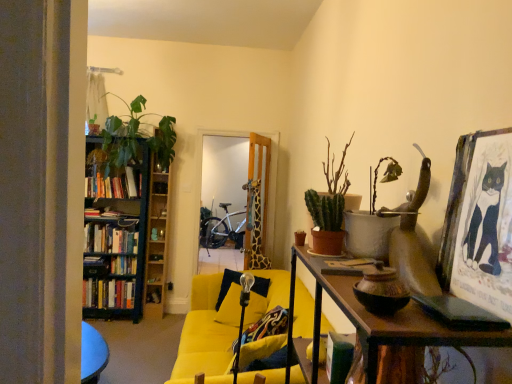
Question: Is wooden bookshelf at left inside or outside of hardcover books at left, the 3th book in the top-to-bottom sequence?

Choices:
 (A) inside
 (B) outside

Answer: (B)

Question: From the image's perspective, is wooden bookshelf at left located above or below hardcover books at left, which appears as the first book when ordered from the bottom?

Choices:
 (A) above
 (B) below

Answer: (A)

Question: Which object is positioned closest to the hardcover books at left, arranged as the first book when viewed from the top?

Choices:
 (A) green matte cactus at upper right, acting as the third houseplant starting from the front
 (B) wooden bookshelf at left
 (C) hardcover books at left, the 3th book in the top-to-bottom sequence
 (D) green matte plant at upper right, arranged as the first houseplant when viewed from the right
 (E) yellow fabric couch at center

Answer: (B)

Question: Estimate the real-world distances between objects in this image. Which object is closer to the yellow fabric couch at center?

Choices:
 (A) green matte cactus at upper right, acting as the third houseplant starting from the front
 (B) silver metallic bicycle at center
 (C) green matte cactus at center-right, positioned as the third houseplant in back-to-front order
 (D) green matte plant at upper right, the 1th houseplant from the front
 (E) hardcover books at left, the 3th book in the top-to-bottom sequence

Answer: (A)